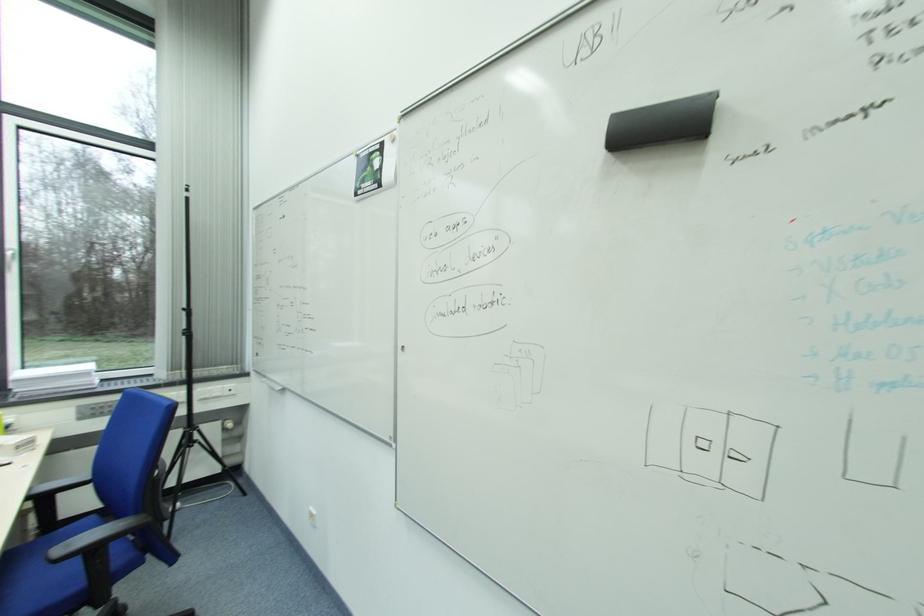
Where is `black chair armrest`? The image size is (924, 616). black chair armrest is located at coordinates (x=96, y=537).